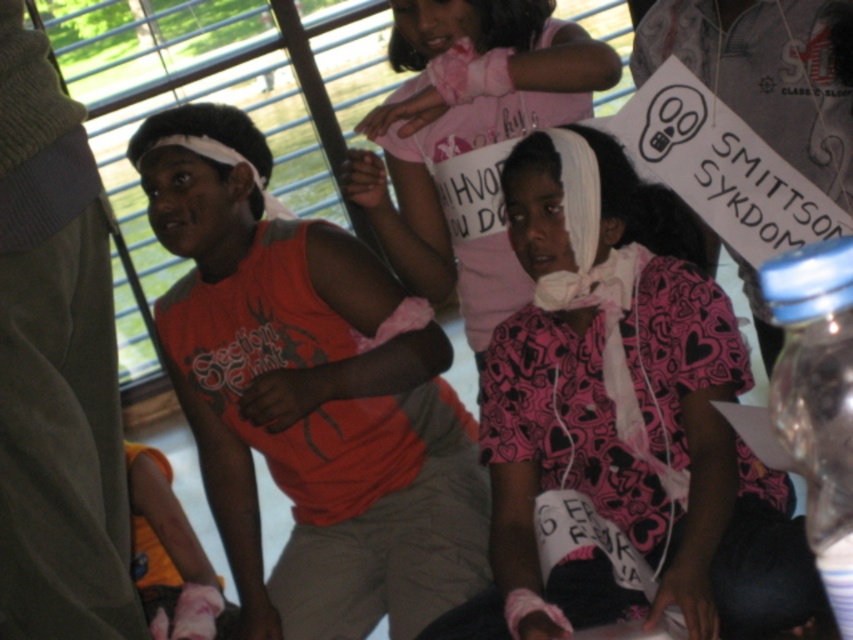
You are a nurse checking the supplies in the room. You see the white bandage at center and the transparent plastic bottle at right. Which item is covering the other one?

The white bandage at center is positioned over transparent plastic bottle at right, so the white bandage is covering the transparent plastic bottle.

You are a nurse checking the medical supplies in the room. You see a white bandage at center and a transparent plastic bottle at right. Which item is wider?

The white bandage at center might be wider than transparent plastic bottle at right.

You are a photographer standing in the room and want to take a photo of the white bandage at center without the camera being visible in the shot. The distance between them is 2.30 meters. Can you position yourself so that the camera is out of frame while still capturing the bandage clearly?

The white bandage at center and camera are 2.30 meters apart from each other. Since the photographer needs to position themselves behind the camera, they can move to a spot where the camera is angled to capture the bandage while keeping their body or the camera itself out of the frame, as the distance allows sufficient space for such an arrangement.